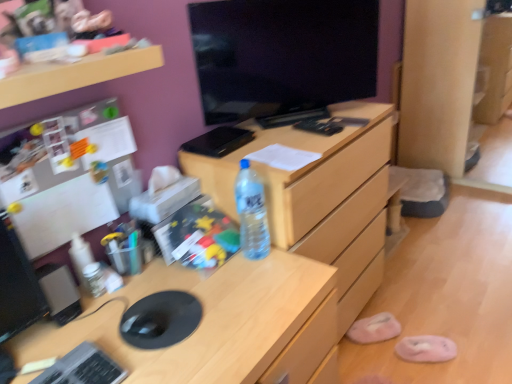
The height and width of the screenshot is (384, 512). I want to click on free location above clear wood file cabinet at center (from a real-world perspective), so tap(290, 125).